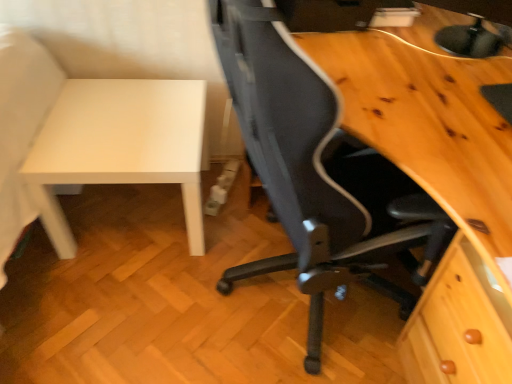
Find the location of `vacant area that is in front of matte black monitor at upper right`. vacant area that is in front of matte black monitor at upper right is located at coordinates (444, 83).